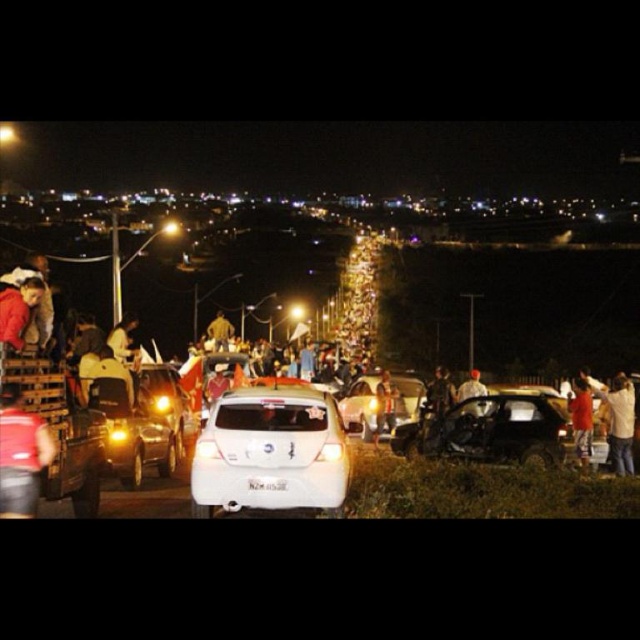
Based on the photo, you are a pedestrian trying to cross the road from the sidewalk on the right side. You see the damaged matte black car at center and the metallic silver truck at lower left. Which vehicle is closer to you as you stand on the sidewalk?

The damaged matte black car at center is closer to you because it is further to the viewer than the metallic silver truck at lower left, meaning it is positioned nearer in the scene.

You are a drone operator trying to capture a clear image of the metallic silver truck at lower left. The camera has a field of view that covers a 0.2x0.2 area. What is the best coordinate to center the camera to ensure the truck is fully visible?

The metallic silver truck at lower left is located at point (x=64, y=432). To center the camera on it within a 0.2x0.2 field of view, the best coordinate would be (x=64, y=432) since the truck is already at the center of the desired area.

You are a pedestrian standing at the camera position. You want to cross the road to reach the city lights in the distance. The metallic silver truck at lower left is blocking your path. Can you safely walk around it if you need to stay at least 2 meters away from it?

The metallic silver truck at lower left is 6.67 meters away from you. Since you need to stay at least 2 meters away, you can safely walk around it as the distance allows sufficient space.